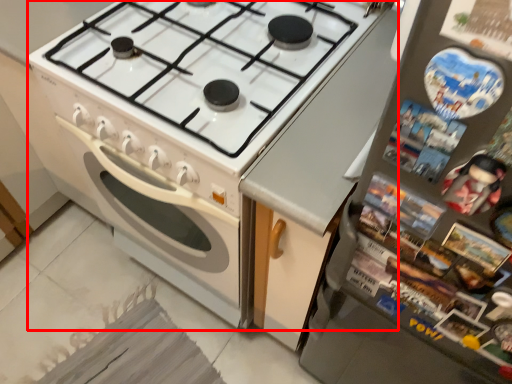
Question: From the image's perspective, considering the relative positions of appliance (annotated by the red box) and refrigerator in the image provided, where is appliance (annotated by the red box) located with respect to the staircase?

Choices:
 (A) below
 (B) above

Answer: (B)